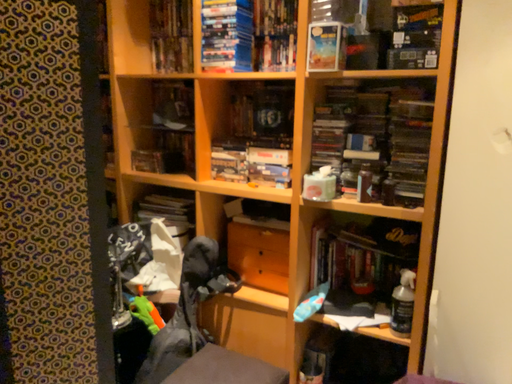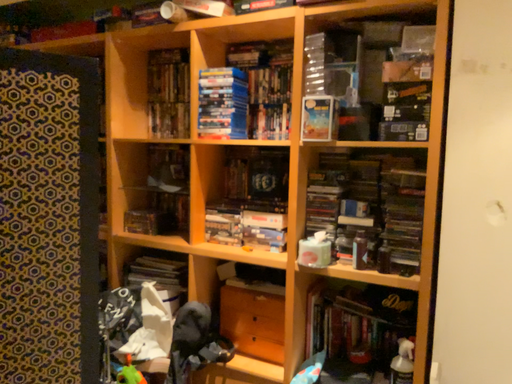
Question: How did the camera likely rotate when shooting the video?

Choices:
 (A) rotated upward
 (B) rotated downward

Answer: (A)